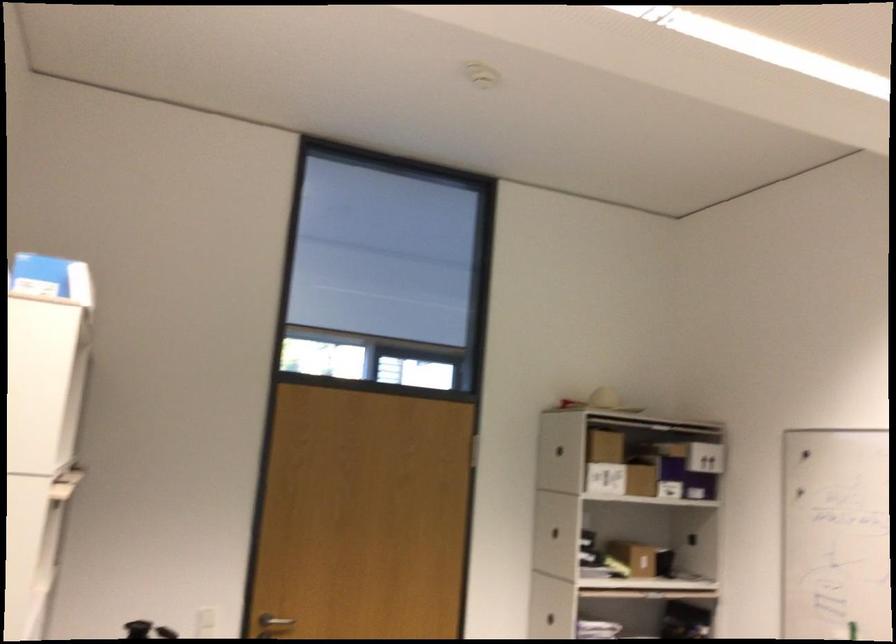
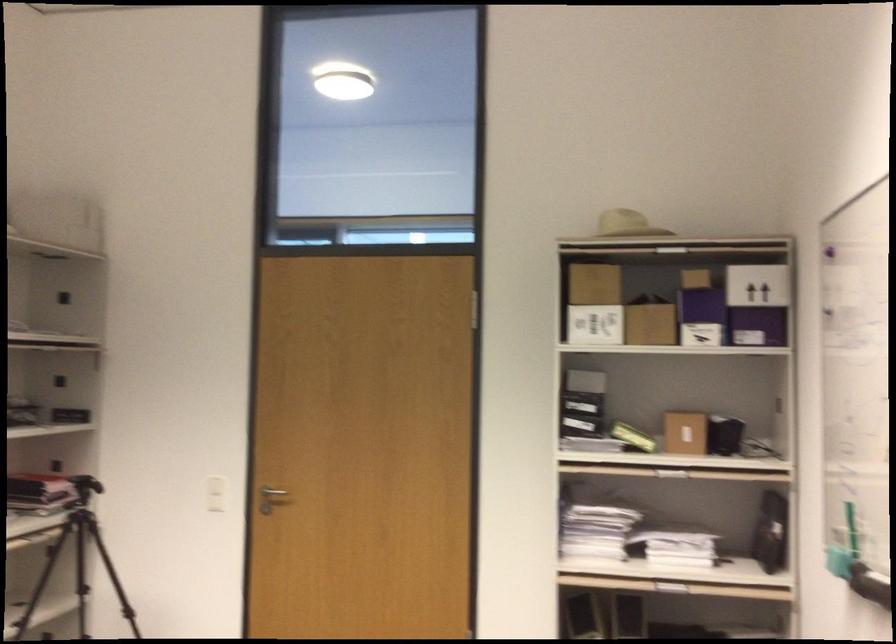
The point at (x=658, y=476) is marked in the first image. Where is the corresponding point in the second image?

(702, 317)